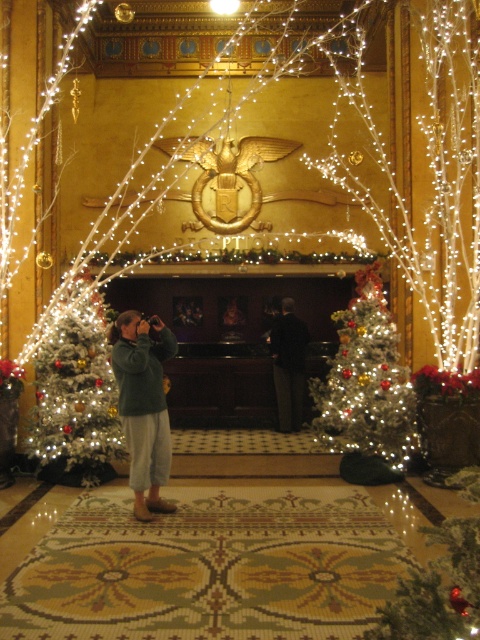
Question: Considering the relative positions of white frosted christmas tree at left and green fleece jacket at center in the image provided, where is white frosted christmas tree at left located with respect to green fleece jacket at center?

Choices:
 (A) left
 (B) right

Answer: (A)

Question: Which object is farther from the camera taking this photo?

Choices:
 (A) green fleece jacket at center
 (B) dark brown suit at center
 (C) white frosted christmas tree at left

Answer: (B)

Question: Observing the image, what is the correct spatial positioning of white frosted christmas tree at center in reference to dark brown suit at center?

Choices:
 (A) right
 (B) left

Answer: (A)

Question: Which point is farther to the camera?

Choices:
 (A) white frosted christmas tree at left
 (B) dark brown suit at center
 (C) green fleece jacket at center

Answer: (B)

Question: Which object is closer to the camera taking this photo?

Choices:
 (A) green fleece jacket at center
 (B) white frosted christmas tree at left

Answer: (A)

Question: Considering the relative positions of white frosted christmas tree at center and green fleece jacket at center in the image provided, where is white frosted christmas tree at center located with respect to green fleece jacket at center?

Choices:
 (A) left
 (B) right

Answer: (B)